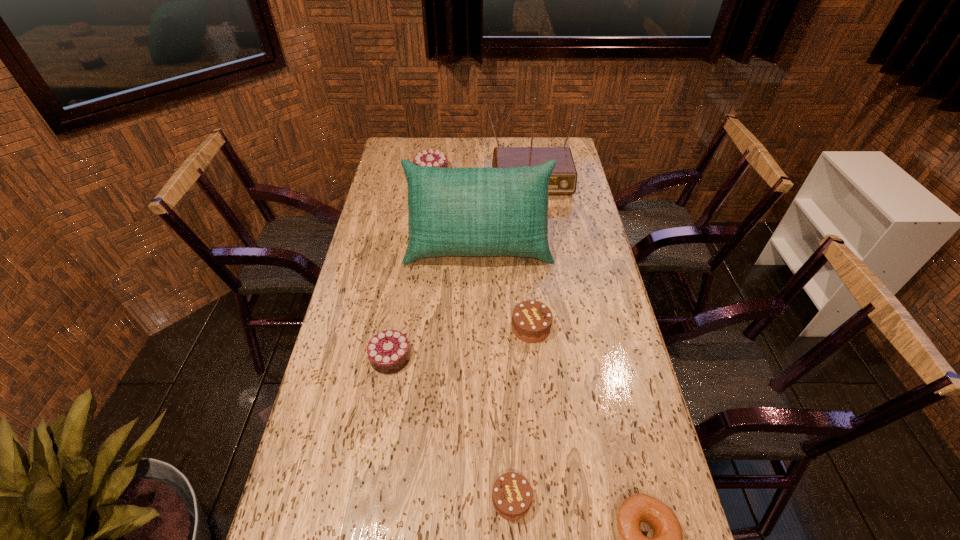
Locate an element on the screen. radio_receiver is located at coordinates (563, 180).

Find the location of a particular element. This screenshot has height=540, width=960. the third farthest object is located at coordinates (479, 212).

I want to click on the bigger chocolate chocolate cake, so click(x=431, y=158).

At what (x,y) coordinates should I click in order to perform the action: click on the farthest chocolate cake. Please return your answer as a coordinate pair (x, y). This screenshot has width=960, height=540. Looking at the image, I should click on (431, 158).

The height and width of the screenshot is (540, 960). Find the location of `the farther brown chocolate cake`. the farther brown chocolate cake is located at coordinates [531, 320].

The height and width of the screenshot is (540, 960). Identify the location of the nearer chocolate chocolate cake. (388, 351).

Find the location of a particular element. the nearer brown chocolate cake is located at coordinates (512, 494).

In order to click on the smaller brown chocolate cake in this screenshot , I will do `click(512, 494)`.

Where is `free space located on the front panel of the radio_receiver`? This screenshot has width=960, height=540. free space located on the front panel of the radio_receiver is located at coordinates (535, 223).

Image resolution: width=960 pixels, height=540 pixels. I want to click on free space located 0.360m on the front-facing side of the cushion, so click(478, 362).